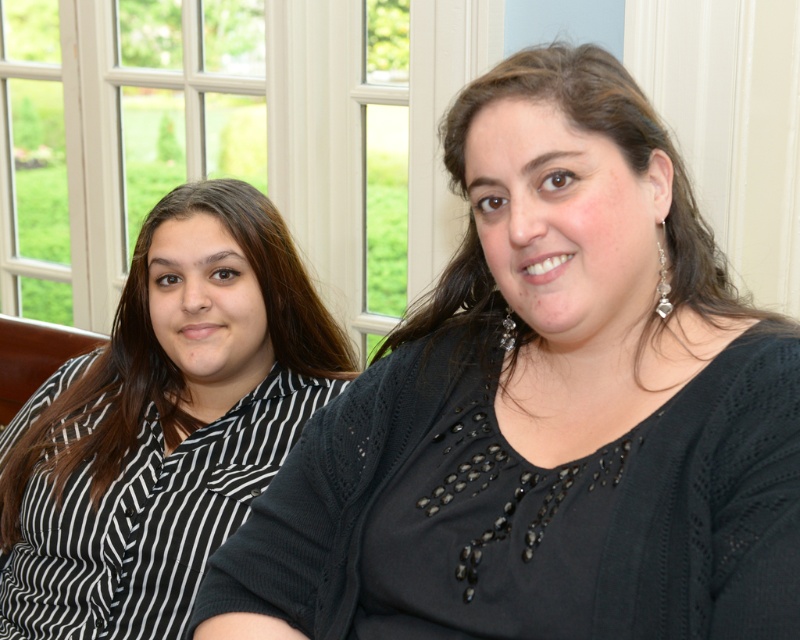
In the scene shown: You are standing in the living room and want to pick up the black knitted sweater at center. Where exactly should you look to find it?

The black knitted sweater at center is located at point (545, 410).

You are a delivery robot standing at the entrance of the room and need to place a package at point [462,253]. The robot is 0.8 meters wide. Is there enough space for the robot to reach the point without moving any furniture?

The distance of point [462,253] from camera is 1.04 meters, so yes, the robot can reach the point since the distance is greater than the robot width of 0.8 meters.